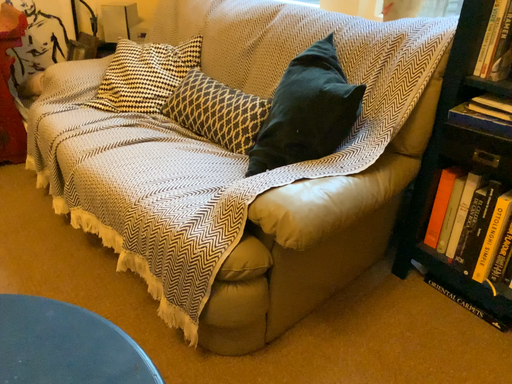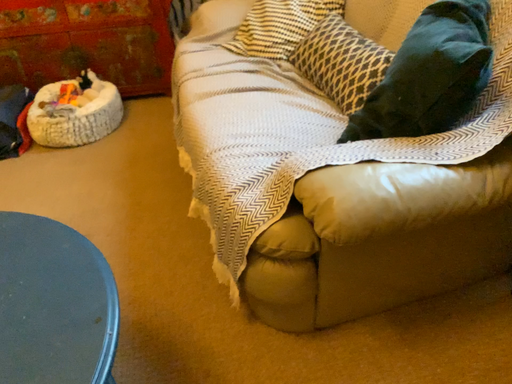
Question: Which way did the camera rotate in the video?

Choices:
 (A) rotated right
 (B) rotated left

Answer: (B)